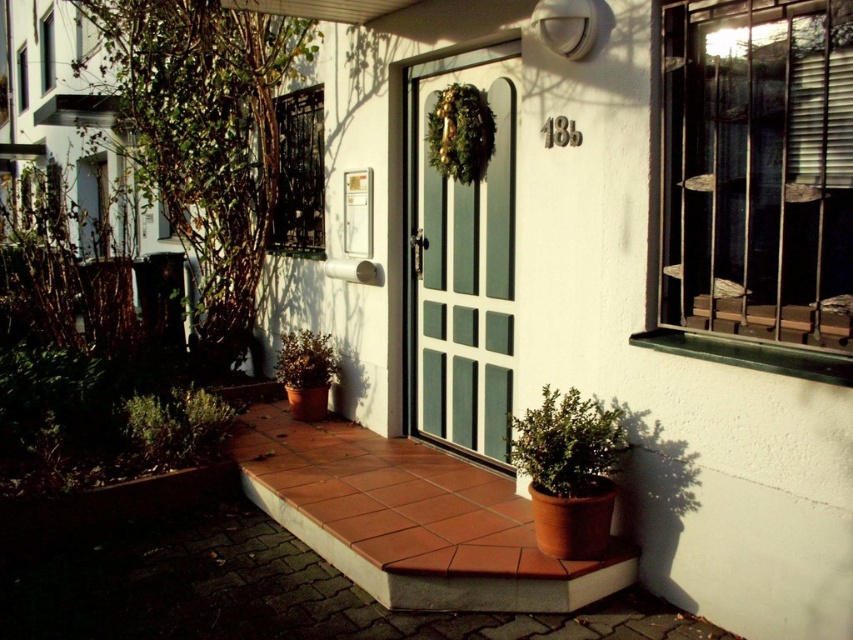
You are standing at the entrance of the residential building and notice two windows at the upper left. Which one is closer to you, the white painted wooden window at upper left or the clear glass window at upper left?

The white painted wooden window at upper left is closer to you because it is in front of the clear glass window at upper left.

In the scene shown: You are standing at the entrance of the residential building and want to locate the white painted wooden window at upper left. Based on the scene description, where would you expect to find this window in relation to other elements?

The white painted wooden window at upper left is located at point coordinates (45, 51), which places it near the top left corner of the scene.